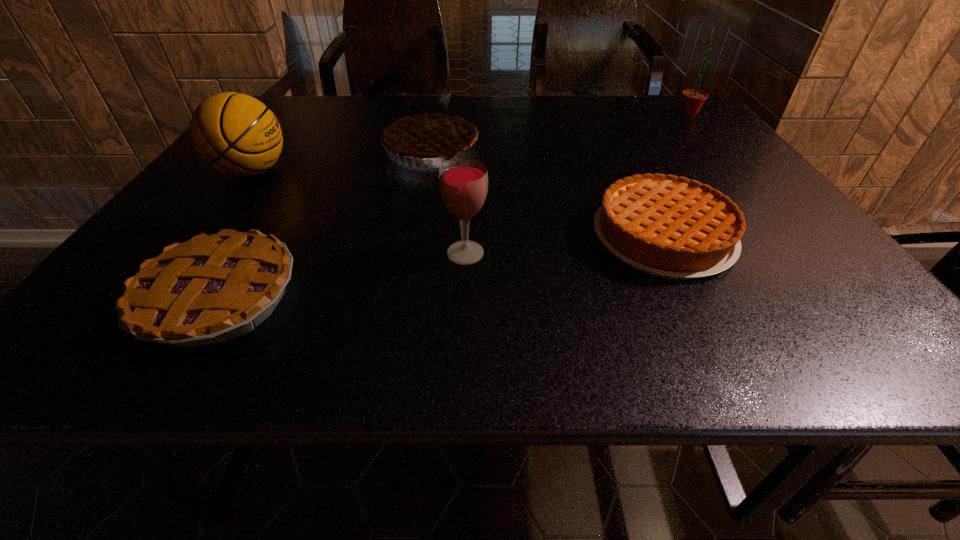
Find the location of a particular element. vacant position at the far right corner of the desktop is located at coordinates (683, 118).

Image resolution: width=960 pixels, height=540 pixels. What are the coordinates of `vacant area that lies between the rightmost object and the wineglass` in the screenshot? It's located at (577, 184).

The height and width of the screenshot is (540, 960). Find the location of `vacant region between the basketball and the farthest pie`. vacant region between the basketball and the farthest pie is located at coordinates (342, 160).

At what (x,y) coordinates should I click in order to perform the action: click on empty space between the fifth object from left to right and the leftmost pie. Please return your answer as a coordinate pair (x, y). Looking at the image, I should click on (441, 266).

The width and height of the screenshot is (960, 540). In order to click on free spot between the sunflower and the wineglass in this screenshot , I will do `click(577, 184)`.

I want to click on unoccupied position between the wineglass and the rightmost pie, so click(564, 244).

At what (x,y) coordinates should I click in order to perform the action: click on vacant space that is in between the farthest pie and the leftmost pie. Please return your answer as a coordinate pair (x, y). Image resolution: width=960 pixels, height=540 pixels. Looking at the image, I should click on (324, 222).

Identify the location of object that is the fifth nearest to the leftmost pie. (692, 100).

You are a GUI agent. You are given a task and a screenshot of the screen. Output one action in this format:
    pyautogui.click(x=<x>, y=<y>)
    Task: Click on the object that is the third closest to the wineglass
    The height and width of the screenshot is (540, 960).
    Given the screenshot: What is the action you would take?
    pyautogui.click(x=431, y=131)

Locate an element on the screen. pie object that ranks as the third closest to the basketball is located at coordinates (668, 226).